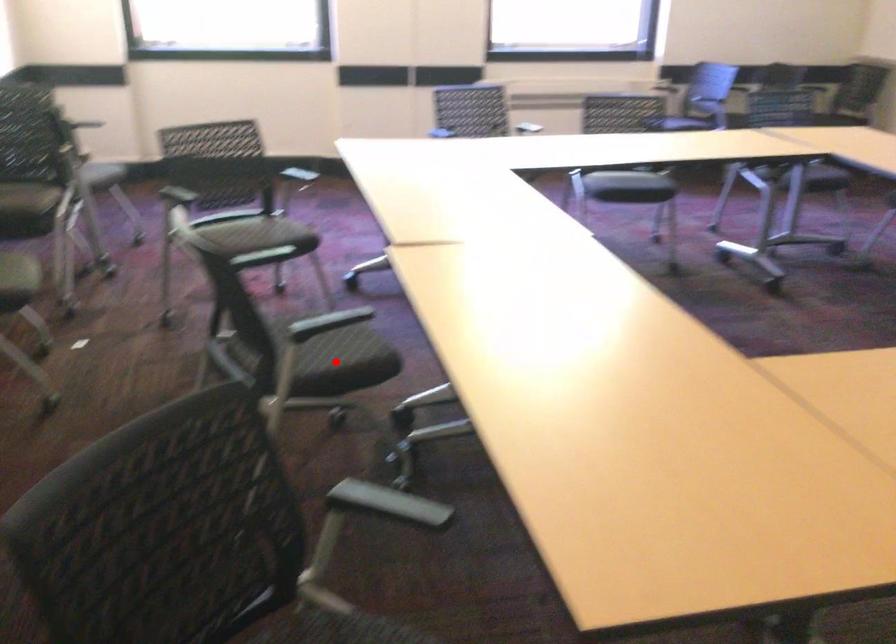
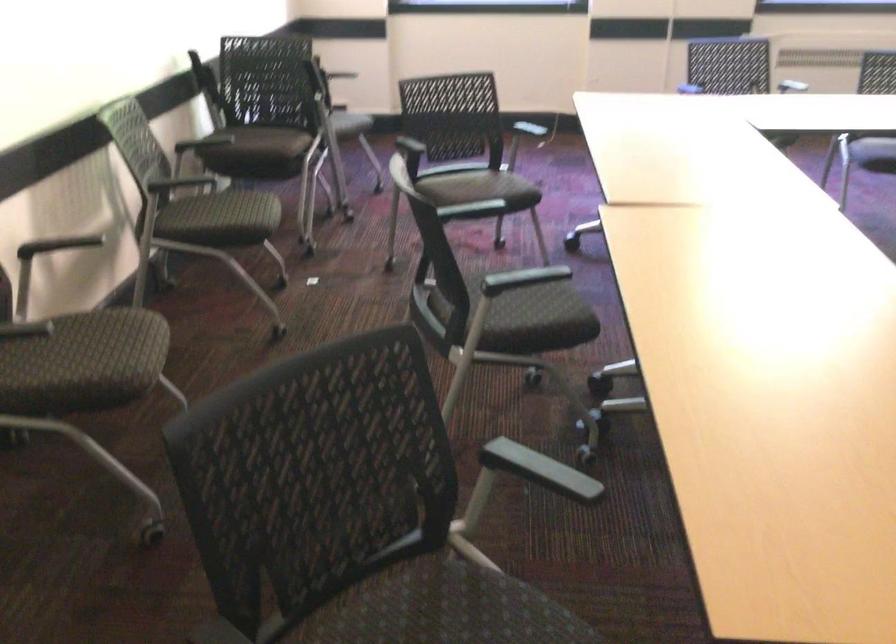
Find the pixel in the second image that matches the highlighted location in the first image.

(530, 319)